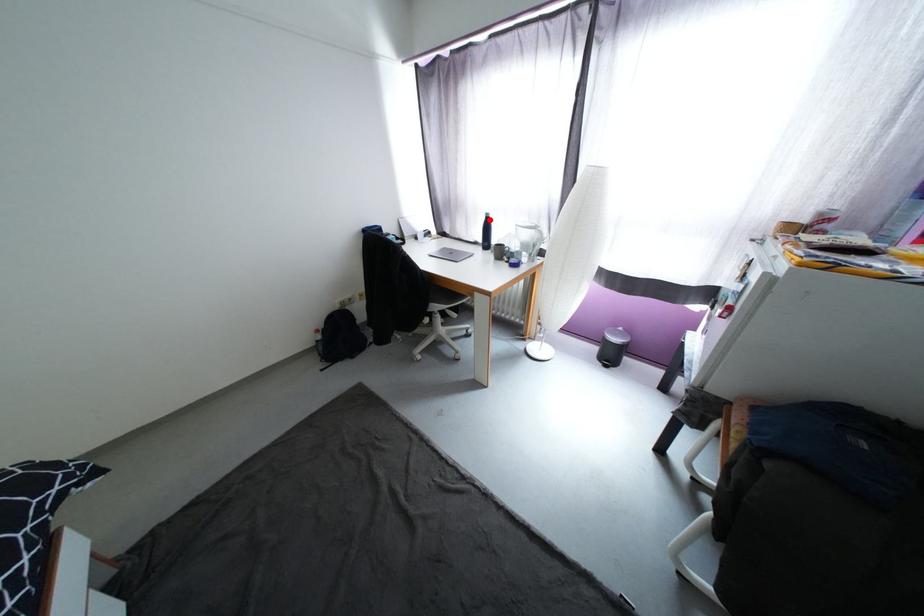
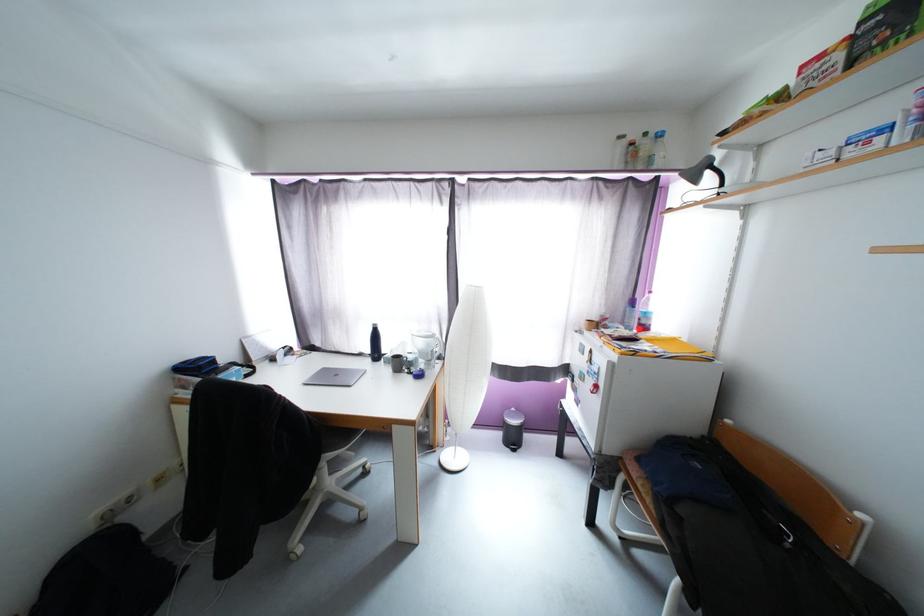
Question: I am providing you with two images of the same scene from different viewpoints. Image1 has a red point marked. In image2, the corresponding 3D location appears at what relative position? Reply with the corresponding letter.

Choices:
 (A) Closer
 (B) Farther

Answer: (B)